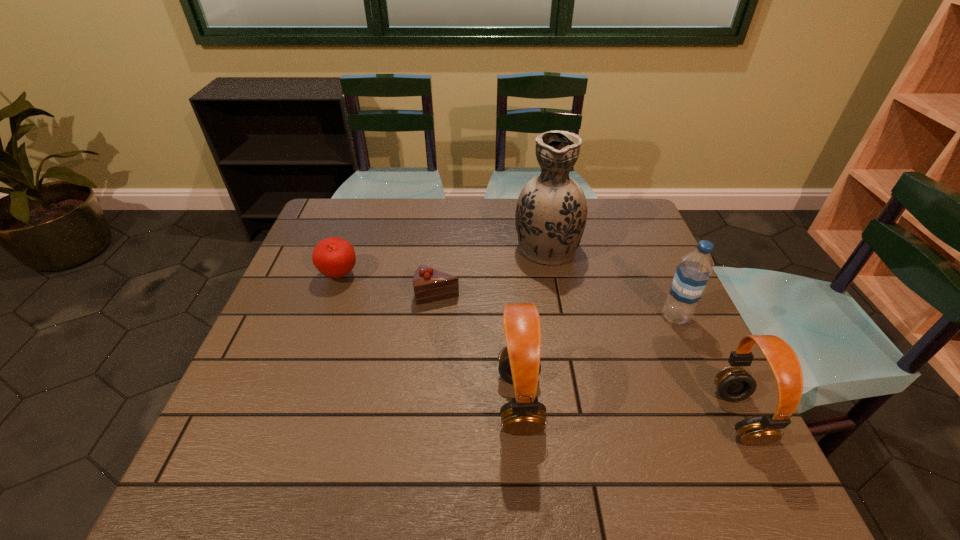
Identify the location of the left headset. (519, 364).

Identify the location of the shorter headset. Image resolution: width=960 pixels, height=540 pixels. (734, 384).

Identify the location of the tallest object. This screenshot has width=960, height=540. (551, 212).

The image size is (960, 540). Find the location of `the fourth farthest object`. the fourth farthest object is located at coordinates (692, 274).

Find the location of a particular element. the shortest object is located at coordinates (429, 284).

This screenshot has width=960, height=540. What are the coordinates of `chocolate cake` in the screenshot? It's located at (429, 284).

Identify the location of apple. (334, 257).

I want to click on the leftmost object, so click(x=334, y=257).

Identify the location of free space located 0.130m on the ear cups of the taller headset. (603, 402).

The image size is (960, 540). Find the location of `vacant space situated with the handle on the side of the tallest object`. vacant space situated with the handle on the side of the tallest object is located at coordinates (538, 198).